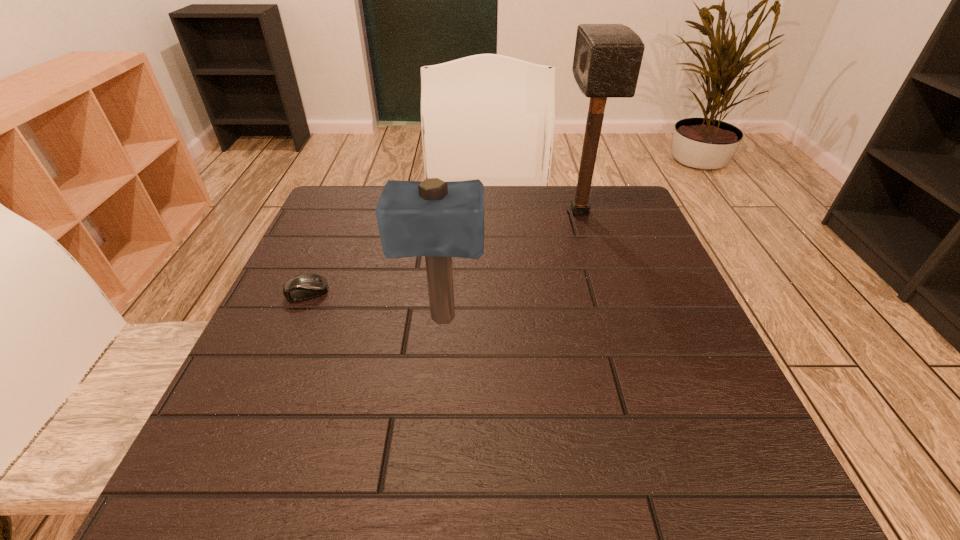
Where is `the right mallet`? This screenshot has height=540, width=960. the right mallet is located at coordinates (607, 58).

This screenshot has height=540, width=960. What are the coordinates of `the farthest object` in the screenshot? It's located at (607, 58).

Find the location of a particular element. This screenshot has width=960, height=540. the left mallet is located at coordinates (439, 220).

This screenshot has width=960, height=540. I want to click on the second object from left to right, so click(x=439, y=220).

Identify the location of the leftmost object. The width and height of the screenshot is (960, 540). (305, 286).

At what (x,y) coordinates should I click in order to perform the action: click on the shortest object. Please return your answer as a coordinate pair (x, y). The height and width of the screenshot is (540, 960). Looking at the image, I should click on (305, 286).

This screenshot has width=960, height=540. Find the location of `vacant area situated on the left of the tallest object`. vacant area situated on the left of the tallest object is located at coordinates (540, 212).

Identify the location of blank space located 0.300m on the back of the nearer mallet. The height and width of the screenshot is (540, 960). (451, 218).

Locate an element on the screen. vacant space situated on the front of the mouse is located at coordinates (282, 351).

Locate an element on the screen. The image size is (960, 540). object that is at the far edge is located at coordinates (607, 58).